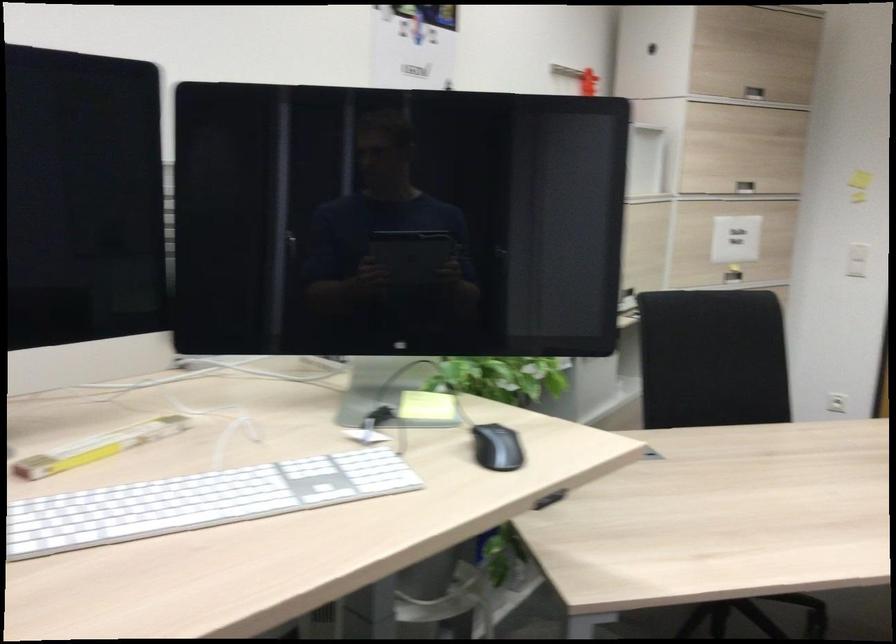
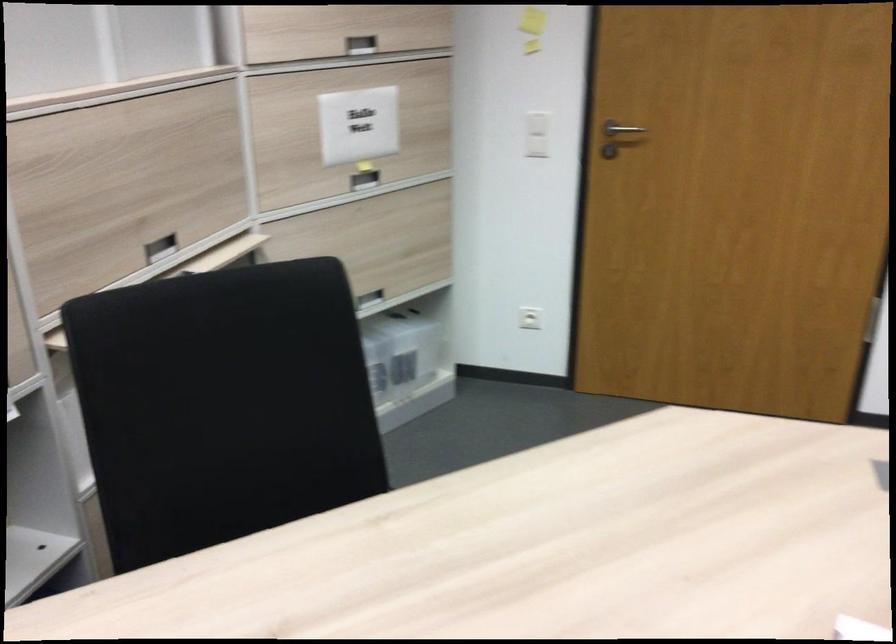
Locate, in the second image, the point that corresponds to [754,185] in the first image.

(360, 44)